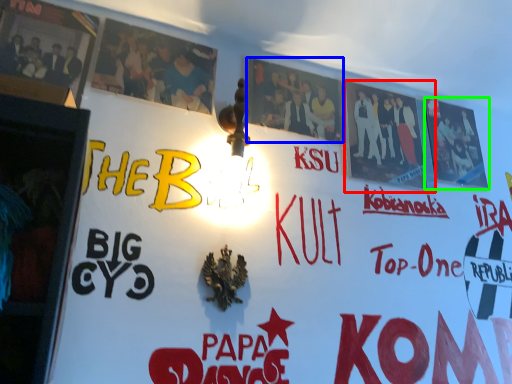
Question: Estimate the real-world distances between objects in this image. Which object is farther from poster (highlighted by a red box), poster (highlighted by a blue box) or poster (highlighted by a green box)?

Choices:
 (A) poster
 (B) poster

Answer: (A)